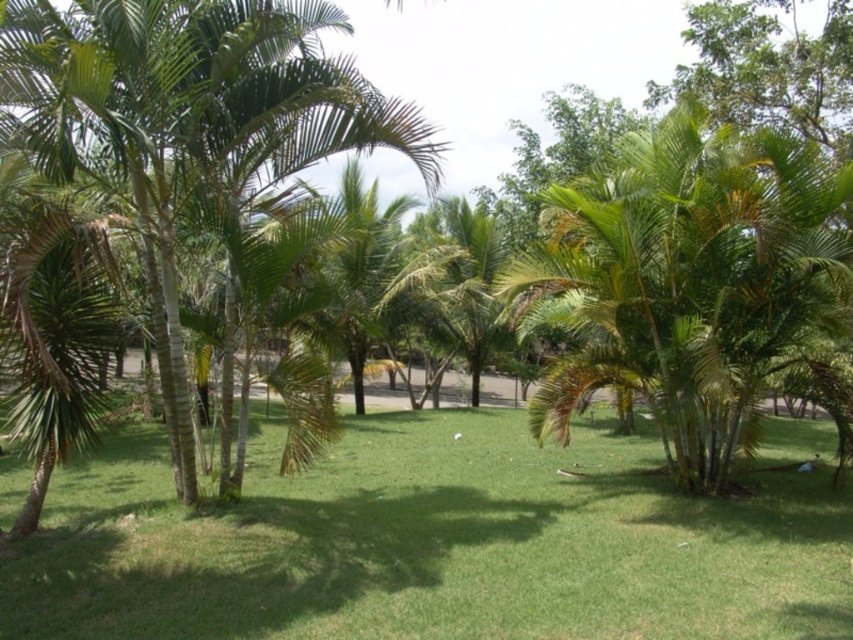
Question: From the image, what is the correct spatial relationship of green grass at center in relation to green leafy palm tree at left?

Choices:
 (A) right
 (B) left

Answer: (A)

Question: Which object is farther from the camera taking this photo?

Choices:
 (A) green leafy palm tree at center
 (B) green grass at center
 (C) green leafy palm tree at left

Answer: (A)

Question: Which object appears farthest from the camera in this image?

Choices:
 (A) green leafy palm tree at left
 (B) green grass at center
 (C) green leafy palm tree at center

Answer: (C)

Question: Is green grass at center to the left of green leafy palm tree at left from the viewer's perspective?

Choices:
 (A) yes
 (B) no

Answer: (B)

Question: Which of the following is the farthest from the observer?

Choices:
 (A) (253, 624)
 (B) (648, 195)
 (C) (137, 196)

Answer: (B)

Question: Is green grass at center wider than green leafy palm tree at left?

Choices:
 (A) no
 (B) yes

Answer: (B)